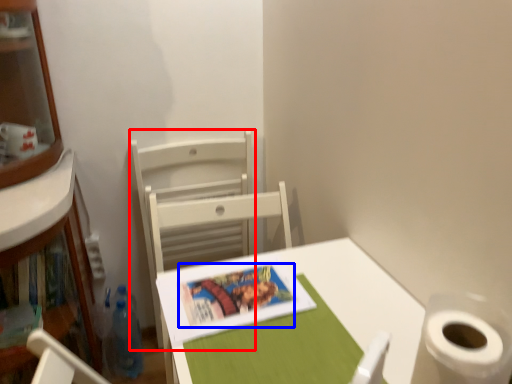
Question: Which object appears farthest to the camera in this image, chair (highlighted by a red box) or book cover (highlighted by a blue box)?

Choices:
 (A) chair
 (B) book cover

Answer: (A)